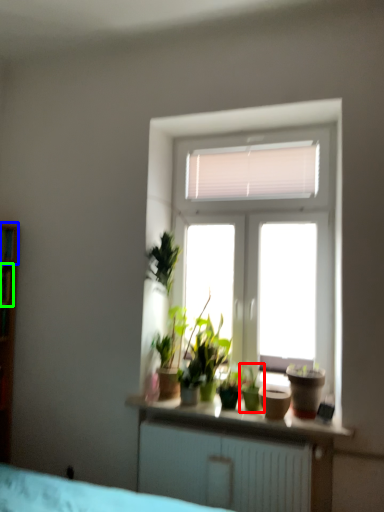
Question: Estimate the real-world distances between objects in this image. Which object is farther from houseplant (highlighted by a red box), shelf (highlighted by a blue box) or window (highlighted by a green box)?

Choices:
 (A) shelf
 (B) window

Answer: (A)